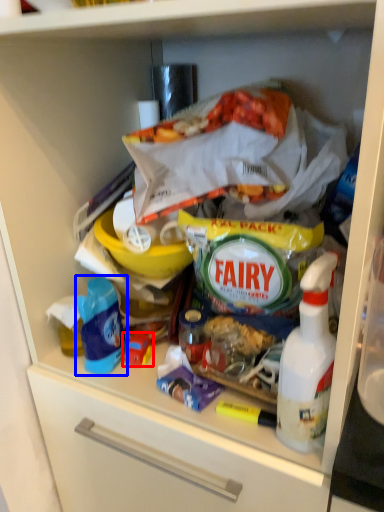
Question: Which point is closer to the camera, toy (highlighted by a red box) or product (highlighted by a blue box)?

Choices:
 (A) toy
 (B) product

Answer: (B)